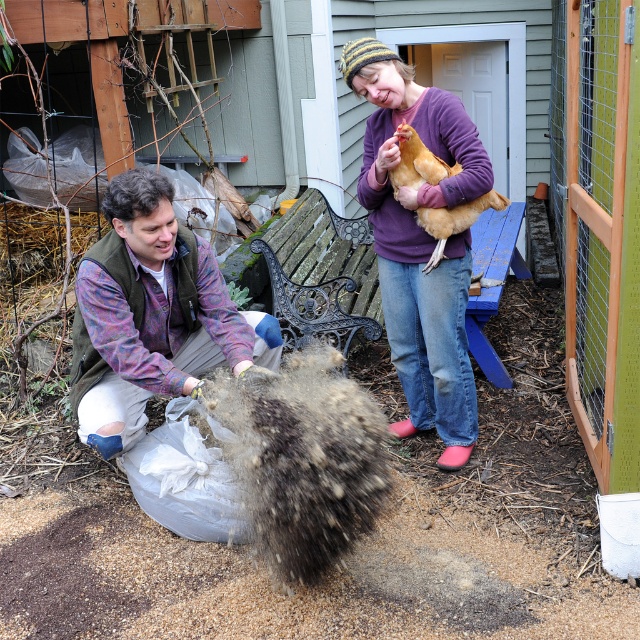
Is purple soft sweater at center positioned in front of golden feathered chicken at upper right?

Yes, it is.

Can you confirm if purple soft sweater at center is thinner than golden feathered chicken at upper right?

No, purple soft sweater at center is not thinner than golden feathered chicken at upper right.

The image size is (640, 640). I want to click on purple soft sweater at center, so click(420, 243).

Does ripped denim jeans at lower left appear on the left side of purple soft sweater at center?

Yes, ripped denim jeans at lower left is to the left of purple soft sweater at center.

Who is higher up, ripped denim jeans at lower left or purple soft sweater at center?

purple soft sweater at center is above.

At what (x,y) coordinates should I click in order to perform the action: click on ripped denim jeans at lower left. Please return your answer as a coordinate pair (x, y). Looking at the image, I should click on [x=150, y=316].

Image resolution: width=640 pixels, height=640 pixels. What are the coordinates of `ripped denim jeans at lower left` in the screenshot? It's located at (150, 316).

Can you confirm if ripped denim jeans at lower left is bigger than golden feathered chicken at upper right?

Yes.

Is point (154, 321) in front of point (413, 157)?

No, (154, 321) is behind (413, 157).

Which is behind, point (172, 337) or point (419, 170)?

Positioned behind is point (172, 337).

Where is `ripped denim jeans at lower left`? ripped denim jeans at lower left is located at coordinates (150, 316).